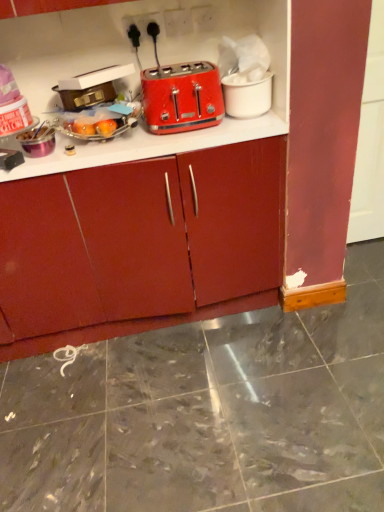
Locate an element on the screen. free space above matte red cabinet at center (from a real-world perspective) is located at coordinates (119, 142).